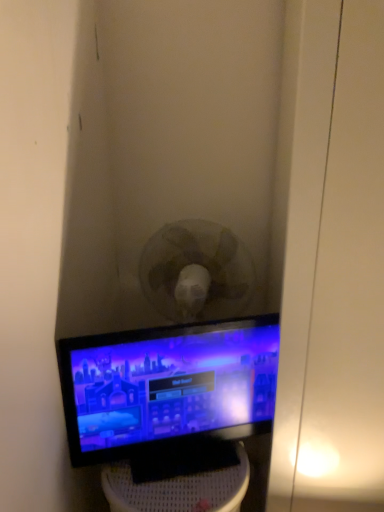
What do you see at coordinates (168, 387) in the screenshot? Image resolution: width=384 pixels, height=512 pixels. I see `matte black monitor at center` at bounding box center [168, 387].

Where is `matte black monitor at center`? Image resolution: width=384 pixels, height=512 pixels. matte black monitor at center is located at coordinates (168, 387).

Describe the element at coordinates (179, 489) in the screenshot. The image size is (384, 512). I see `black matte monitor at center` at that location.

What is the approximate width of black matte monitor at center?

33.68 centimeters.

I want to click on black matte monitor at center, so coord(179,489).

Measure the distance between point (138, 484) and camera.

Point (138, 484) is 1.09 meters away from camera.

The width and height of the screenshot is (384, 512). Find the location of `matte black monitor at center`. matte black monitor at center is located at coordinates (168, 387).

Which is more to the left, matte black monitor at center or black matte monitor at center?

black matte monitor at center.

Which object is closer to the camera taking this photo, matte black monitor at center or black matte monitor at center?

Positioned in front is black matte monitor at center.

Does point (174, 366) come farther from viewer compared to point (153, 502)?

That is True.

From the image's perspective, which object appears higher, matte black monitor at center or black matte monitor at center?

matte black monitor at center is shown above in the image.

From a real-world perspective, does matte black monitor at center stand above black matte monitor at center?

Indeed, from a real-world perspective, matte black monitor at center stands above black matte monitor at center.

Between matte black monitor at center and black matte monitor at center, which one has larger width?

black matte monitor at center is wider.

Is matte black monitor at center taller than black matte monitor at center?

In fact, matte black monitor at center may be shorter than black matte monitor at center.

Is matte black monitor at center bigger or smaller than black matte monitor at center?

In the image, matte black monitor at center appears to be smaller than black matte monitor at center.

Which is correct: matte black monitor at center is inside black matte monitor at center, or outside of it?

matte black monitor at center cannot be found inside black matte monitor at center.

Consider the image. Is matte black monitor at center positioned far away from black matte monitor at center?

No, matte black monitor at center is not far away from black matte monitor at center.

Is matte black monitor at center turned away from black matte monitor at center?

No.

The height and width of the screenshot is (512, 384). Identify the location of furniture below the matte black monitor at center (from the image's perspective). (179, 489).

Does black matte monitor at center appear on the right side of matte black monitor at center?

Incorrect, black matte monitor at center is not on the right side of matte black monitor at center.

Consider the image. Which object is closer to the camera taking this photo, black matte monitor at center or matte black monitor at center?

Positioned in front is black matte monitor at center.

Which is closer, (192,481) or (165,462)?

Clearly, point (192,481) is closer to the camera than point (165,462).

From the image's perspective, which is below, black matte monitor at center or matte black monitor at center?

black matte monitor at center is shown below in the image.

From a real-world perspective, which object stands above the other?

matte black monitor at center, from a real-world perspective.

Does black matte monitor at center have a lesser width compared to matte black monitor at center?

In fact, black matte monitor at center might be wider than matte black monitor at center.

Can you confirm if black matte monitor at center is shorter than matte black monitor at center?

Incorrect, the height of black matte monitor at center does not fall short of that of matte black monitor at center.

Can you confirm if black matte monitor at center is bigger than matte black monitor at center?

Yes.

Is matte black monitor at center completely or partially inside black matte monitor at center?

No, matte black monitor at center is not a part of black matte monitor at center.

Would you say black matte monitor at center is a long distance from matte black monitor at center?

No, there isn't a large distance between black matte monitor at center and matte black monitor at center.

Is black matte monitor at center looking in the opposite direction of matte black monitor at center?

No, black matte monitor at center's orientation is not away from matte black monitor at center.

This screenshot has width=384, height=512. I want to click on computer monitor behind the black matte monitor at center, so click(x=168, y=387).

Where is `furniture in front of the matte black monitor at center`? Image resolution: width=384 pixels, height=512 pixels. furniture in front of the matte black monitor at center is located at coordinates (179, 489).

Find the location of a particular element. Image resolution: width=384 pixels, height=512 pixels. computer monitor that is behind the black matte monitor at center is located at coordinates (168, 387).